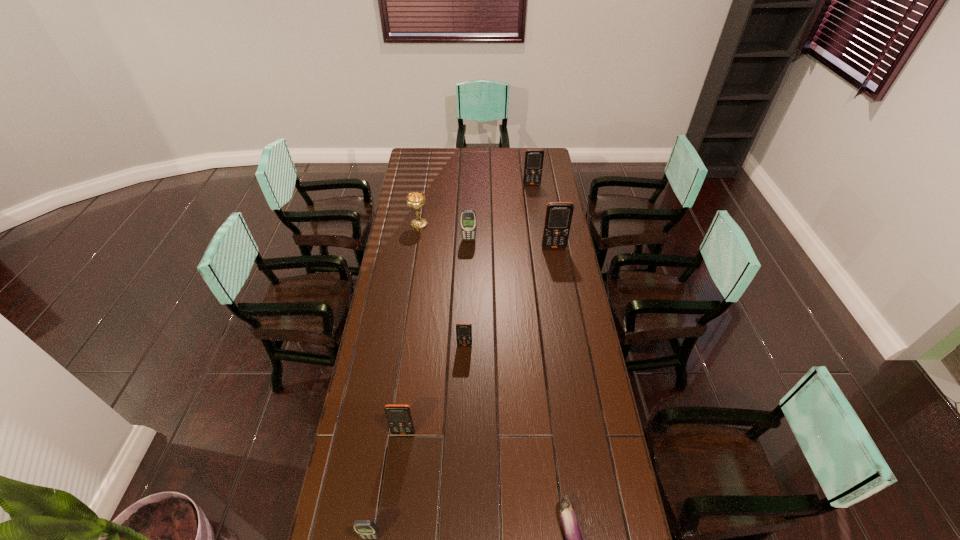
I want to click on the second nearest orange cellular telephone, so click(x=463, y=330).

The height and width of the screenshot is (540, 960). In order to click on the nearest cellular telephone in this screenshot , I will do `click(366, 529)`.

Locate an element on the screen. the smaller gray cellular telephone is located at coordinates (366, 529).

Where is `blank area located 0.390m on the screen of the tallest object`? blank area located 0.390m on the screen of the tallest object is located at coordinates (565, 312).

Identify the location of vacant position located 0.290m on the screen of the farthest orange cellular telephone. This screenshot has height=540, width=960. (537, 218).

Image resolution: width=960 pixels, height=540 pixels. Find the location of `vacant region located on the screen of the farther gray cellular telephone`. vacant region located on the screen of the farther gray cellular telephone is located at coordinates (468, 256).

I want to click on blank space located 0.080m on the screen of the leftmost orange cellular telephone, so click(x=400, y=459).

Locate an element on the screen. The image size is (960, 540). free space located on the front of the chalice is located at coordinates (414, 260).

I want to click on vacant space located on the screen of the third farthest orange cellular telephone, so click(x=463, y=421).

Where is `chalice located at the left edge`? chalice located at the left edge is located at coordinates (416, 200).